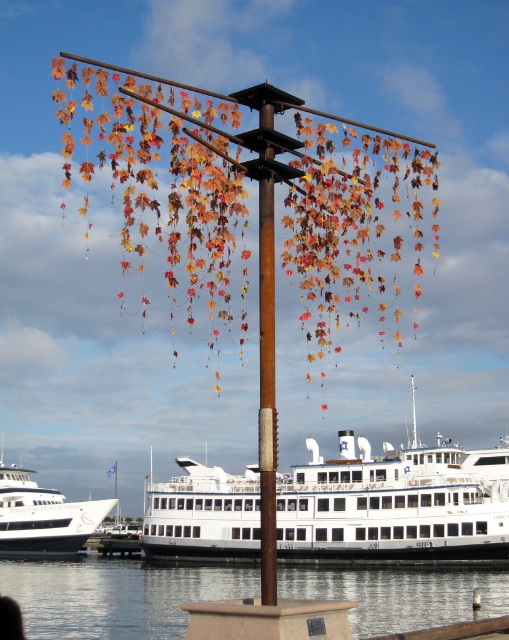
Is point (221, 512) farther from viewer compared to point (127, 579)?

No, it is in front of (127, 579).

I want to click on white matte ferry at center, so click(x=394, y=504).

Where is `white matte ferry at center`? white matte ferry at center is located at coordinates (394, 504).

Does transparent glass water at lower center have a greater width compared to white glossy ferry at lower left?

Correct, the width of transparent glass water at lower center exceeds that of white glossy ferry at lower left.

Between point (448, 568) and point (39, 512), which one is positioned behind?

The point (39, 512) is more distant.

Is point (31, 621) less distant than point (30, 525)?

Yes.

You are a GUI agent. You are given a task and a screenshot of the screen. Output one action in this format:
    pyautogui.click(x=<x>, y=<y>)
    Task: Click on the transparent glass water at lower center
    
    Given the screenshot: What is the action you would take?
    pyautogui.click(x=115, y=595)

Can you confirm if white matte ferry at center is taller than white glossy ferry at lower left?

Yes, white matte ferry at center is taller than white glossy ferry at lower left.

This screenshot has width=509, height=640. What do you see at coordinates (394, 504) in the screenshot? I see `white matte ferry at center` at bounding box center [394, 504].

Find the location of a particular element. This screenshot has width=509, height=640. white matte ferry at center is located at coordinates (394, 504).